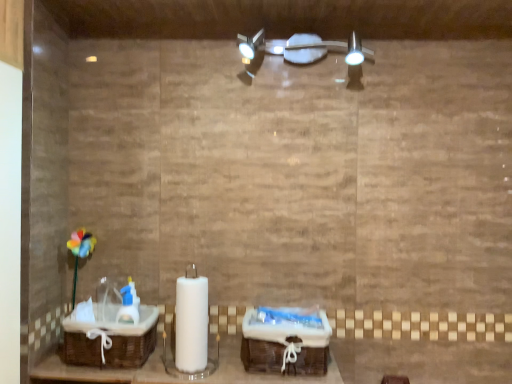
Locate an element on the screen. brown woven basket at lower left is located at coordinates (110, 329).

Image resolution: width=512 pixels, height=384 pixels. In order to click on satin nickel light fixture at upper center in this screenshot , I will do `click(298, 51)`.

The width and height of the screenshot is (512, 384). I want to click on woven brown baskets at center, so click(170, 376).

Which object is closer to the camera taking this photo, woven brown baskets at center or satin nickel light fixture at upper center?

Positioned in front is woven brown baskets at center.

How many degrees apart are the facing directions of woven brown baskets at center and satin nickel light fixture at upper center?

0.589 degrees.

Are woven brown baskets at center and satin nickel light fixture at upper center far apart?

No.

Which of these two, woven brown baskets at center or satin nickel light fixture at upper center, is wider?

woven brown baskets at center is wider.

Can you confirm if woven brown baskets at center is positioned to the right of brown woven basket at lower left?

Yes, woven brown baskets at center is to the right of brown woven basket at lower left.

From the image's perspective, is woven brown baskets at center beneath brown woven basket at lower left?

Correct, woven brown baskets at center appears lower than brown woven basket at lower left in the image.

Considering the positions of point (298, 379) and point (130, 365), is point (298, 379) closer or farther from the camera than point (130, 365)?

Point (298, 379) is closer to the camera than point (130, 365).

Can you confirm if woven brown baskets at center is wider than brown woven basket at lower left?

Correct, the width of woven brown baskets at center exceeds that of brown woven basket at lower left.

From the image's perspective, is satin nickel light fixture at upper center beneath brown woven basket at lower left?

Incorrect, from the image's perspective, satin nickel light fixture at upper center is higher than brown woven basket at lower left.

Based on the photo, could you tell me if satin nickel light fixture at upper center is facing brown woven basket at lower left?

No, satin nickel light fixture at upper center is not turned towards brown woven basket at lower left.

Which is correct: satin nickel light fixture at upper center is inside brown woven basket at lower left, or outside of it?

satin nickel light fixture at upper center is not enclosed by brown woven basket at lower left.

Is satin nickel light fixture at upper center not close to woven brown baskets at center?

That's not correct — satin nickel light fixture at upper center is a little close to woven brown baskets at center.

Does satin nickel light fixture at upper center lie in front of woven brown baskets at center?

No, it is not.

What's the angular difference between satin nickel light fixture at upper center and woven brown baskets at center's facing directions?

There is a 0.589-degree angle between the facing directions of satin nickel light fixture at upper center and woven brown baskets at center.

Which of these two, satin nickel light fixture at upper center or woven brown baskets at center, is thinner?

satin nickel light fixture at upper center is thinner.

Is brown woven basket at lower left aimed at woven brown baskets at center?

No, brown woven basket at lower left is not facing towards woven brown baskets at center.

Which object is positioned more to the left, brown woven basket at lower left or woven brown baskets at center?

brown woven basket at lower left is more to the left.

You are a GUI agent. You are given a task and a screenshot of the screen. Output one action in this format:
    pyautogui.click(x=<x>, y=<y>)
    Task: Click on the sink above the woven brown baskets at center (from the image's perspective)
    The image size is (512, 384).
    Given the screenshot: What is the action you would take?
    pyautogui.click(x=110, y=329)

Considering the relative sizes of brown woven basket at lower left and woven brown baskets at center in the image provided, is brown woven basket at lower left smaller than woven brown baskets at center?

Incorrect, brown woven basket at lower left is not smaller in size than woven brown baskets at center.

Based on the photo, is brown woven basket at lower left surrounding satin nickel light fixture at upper center?

No, satin nickel light fixture at upper center is located outside of brown woven basket at lower left.

From the image's perspective, between brown woven basket at lower left and satin nickel light fixture at upper center, which one is located above?

From the image's view, satin nickel light fixture at upper center is above.

Are brown woven basket at lower left and satin nickel light fixture at upper center beside each other?

No.

Is brown woven basket at lower left wider than satin nickel light fixture at upper center?

Correct, the width of brown woven basket at lower left exceeds that of satin nickel light fixture at upper center.

Locate an element on the screen. The height and width of the screenshot is (384, 512). furniture on the left of satin nickel light fixture at upper center is located at coordinates (170, 376).

Where is `sink located above the woven brown baskets at center (from the image's perspective)`? sink located above the woven brown baskets at center (from the image's perspective) is located at coordinates (110, 329).

When comparing their distances from brown woven basket at lower left, does woven brown baskets at center or satin nickel light fixture at upper center seem further?

The object further to brown woven basket at lower left is satin nickel light fixture at upper center.

Based on their spatial positions, is brown woven basket at lower left or satin nickel light fixture at upper center further from woven brown baskets at center?

satin nickel light fixture at upper center is positioned further to the anchor woven brown baskets at center.

Which object lies further to the anchor point satin nickel light fixture at upper center, brown woven basket at lower left or woven brown baskets at center?

brown woven basket at lower left.

Looking at the image, which one is located further to satin nickel light fixture at upper center, woven brown baskets at center or brown woven basket at lower left?

The object further to satin nickel light fixture at upper center is brown woven basket at lower left.

From the image, which object appears to be nearer to woven brown baskets at center, satin nickel light fixture at upper center or brown woven basket at lower left?

The object closer to woven brown baskets at center is brown woven basket at lower left.

When comparing their distances from brown woven basket at lower left, does satin nickel light fixture at upper center or woven brown baskets at center seem closer?

woven brown baskets at center is positioned closer to the anchor brown woven basket at lower left.

Locate an element on the screen. Image resolution: width=512 pixels, height=384 pixels. sink between satin nickel light fixture at upper center and woven brown baskets at center in the vertical direction is located at coordinates (110, 329).